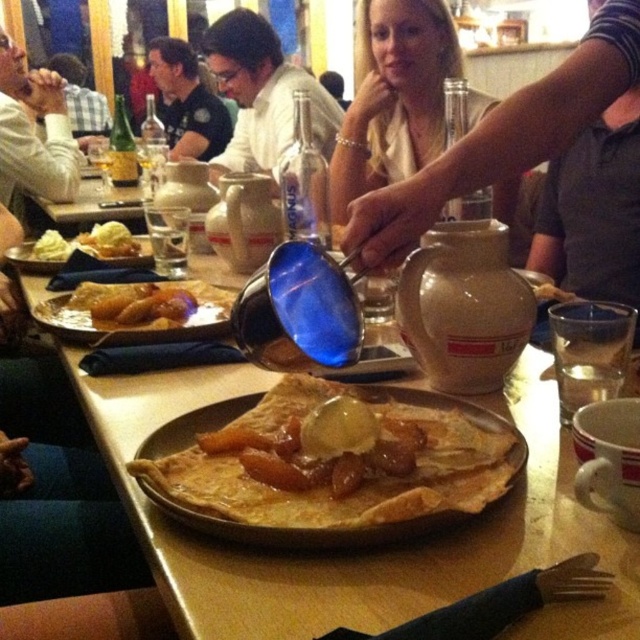
Please describe the exact position of the golden crispy crepe at center in the image using coordinates.

The golden crispy crepe at center is located at coordinates point (326, 486).

You are standing at the entrance of the restaurant and want to take a photo of the point at coordinates (417, 396). The camera you have can focus on objects within 25 inches. Will the point be in focus?

The point at coordinates (417, 396) is 26.98 inches from the camera, which is beyond the 25 inches focus range. Therefore, the point will not be in focus.